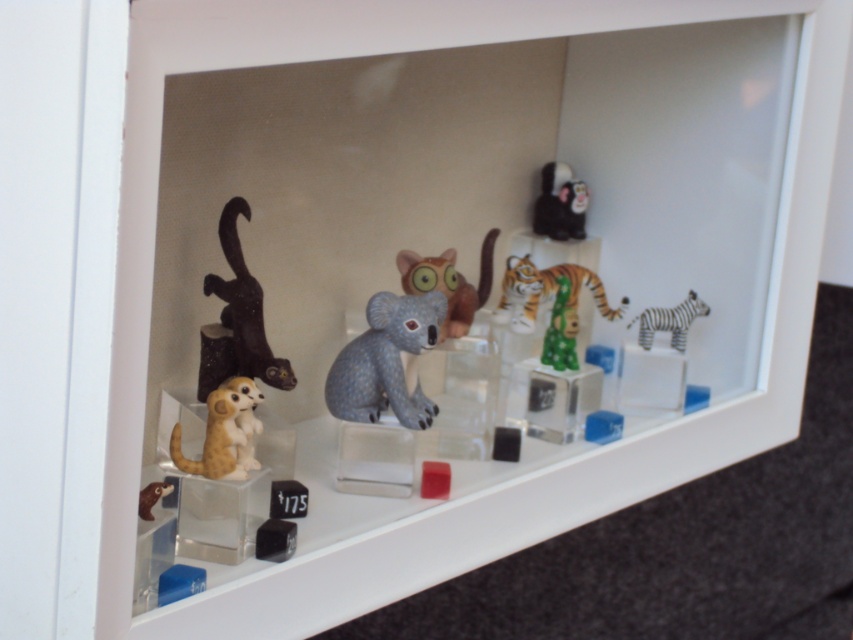
Which of these two, matte black monkey at upper right or green glossy cube at center, stands taller?

green glossy cube at center

Locate an element on the screen. The image size is (853, 640). matte black monkey at upper right is located at coordinates (560, 204).

Does point (548, 230) come in front of point (654, 324)?

No, (548, 230) is further to viewer.

Does matte black monkey at upper right have a larger size compared to striped matte zebra at right?

Actually, matte black monkey at upper right might be smaller than striped matte zebra at right.

Which is behind, point (563, 204) or point (633, 320)?

The point (563, 204) is more distant.

The height and width of the screenshot is (640, 853). Find the location of `matte black monkey at upper right`. matte black monkey at upper right is located at coordinates (560, 204).

Which is above, striped fur tiger at center or striped matte zebra at right?

striped fur tiger at center

Who is more forward, (506, 305) or (695, 312)?

Point (695, 312) is more forward.

Where is `striped fur tiger at center`? Image resolution: width=853 pixels, height=640 pixels. striped fur tiger at center is located at coordinates (548, 292).